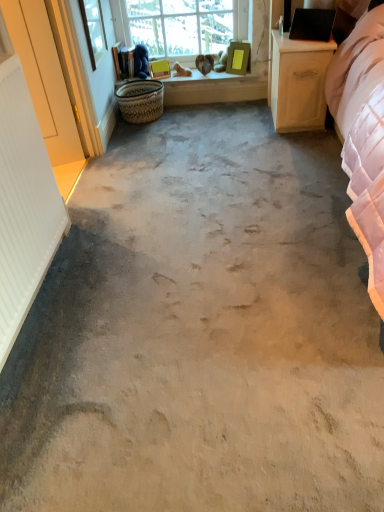
The width and height of the screenshot is (384, 512). Find the location of `vacant space that's between light wood/wooden nightstand at right and woven natural basket at center`. vacant space that's between light wood/wooden nightstand at right and woven natural basket at center is located at coordinates (212, 121).